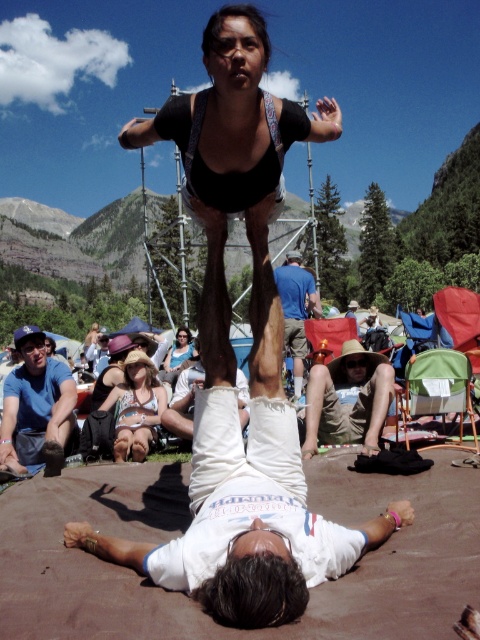
Which is in front, point (25, 356) or point (357, 432)?

Point (357, 432) is more forward.

Does blue t-shirt at lower left have a greater width compared to tan straw hat at center?

No.

This screenshot has width=480, height=640. I want to click on blue t-shirt at lower left, so click(x=36, y=406).

Is tan straw hat at center above light blue denim shorts at center?

Actually, tan straw hat at center is below light blue denim shorts at center.

Consider the image. Which is below, tan straw hat at center or light blue denim shorts at center?

Positioned lower is tan straw hat at center.

Which is behind, point (340, 356) or point (188, 330)?

Positioned behind is point (188, 330).

Find the location of `tan straw hat at center`. tan straw hat at center is located at coordinates (348, 403).

From the picture: Can you confirm if blue t-shirt at lower left is thinner than blue cotton shirt at center?

No, blue t-shirt at lower left is not thinner than blue cotton shirt at center.

The image size is (480, 640). What do you see at coordinates (36, 406) in the screenshot? I see `blue t-shirt at lower left` at bounding box center [36, 406].

The height and width of the screenshot is (640, 480). Describe the element at coordinates (36, 406) in the screenshot. I see `blue t-shirt at lower left` at that location.

At what (x,y) coordinates should I click in order to perform the action: click on blue t-shirt at lower left. Please return your answer as a coordinate pair (x, y). The image size is (480, 640). Looking at the image, I should click on (36, 406).